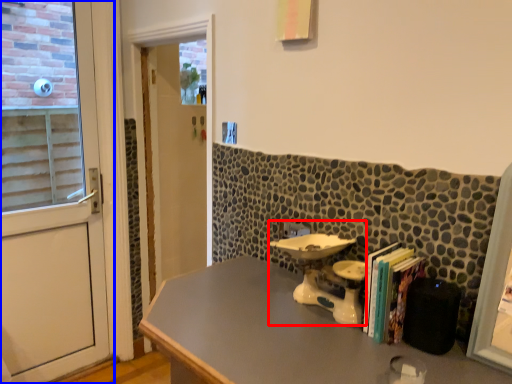
Question: Which object is closer to the camera taking this photo, sink (highlighted by a red box) or door (highlighted by a blue box)?

Choices:
 (A) sink
 (B) door

Answer: (A)